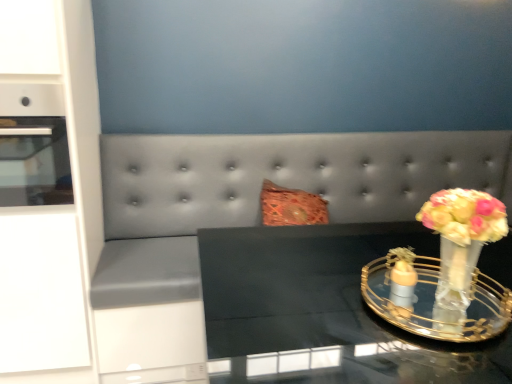
Locate an element on the screen. The image size is (512, 384). free space to the back side of clear glass vase at right, which is counted as the first candle holder, starting from the right is located at coordinates (356, 247).